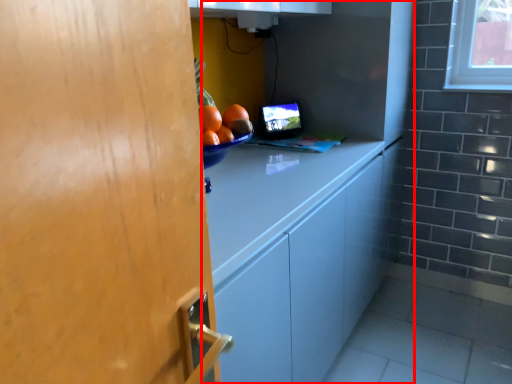
Question: From the image, what is the correct spatial relationship of cabinetry (annotated by the red box) in relation to computer monitor?

Choices:
 (A) left
 (B) right

Answer: (B)